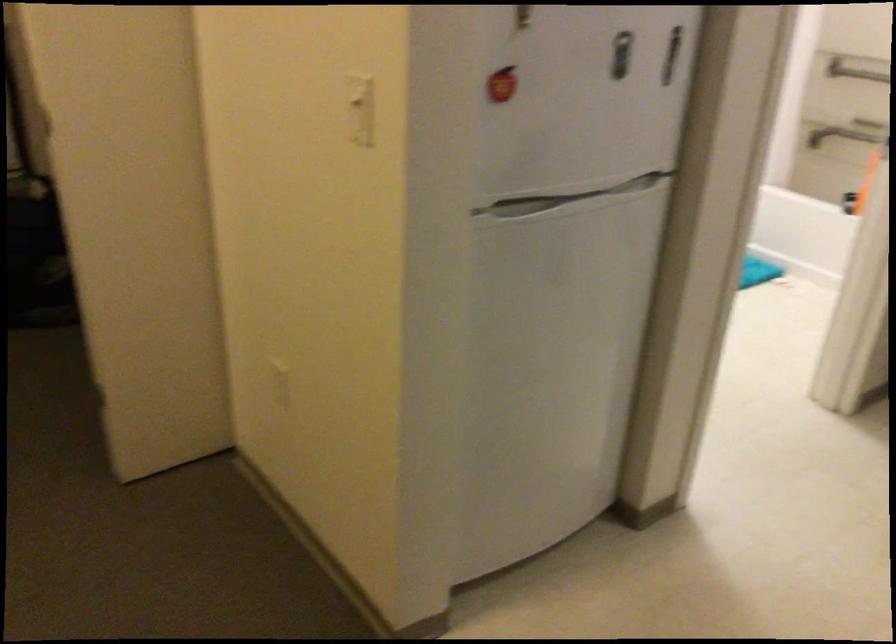
Identify the location of red apple magnet. The width and height of the screenshot is (896, 644). (502, 84).